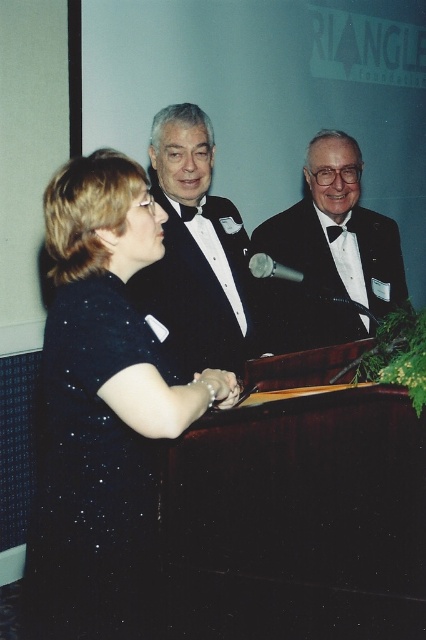
Question: Considering the relative positions of black satin tuxedo at center and black satin suit at center in the image provided, where is black satin tuxedo at center located with respect to black satin suit at center?

Choices:
 (A) below
 (B) above

Answer: (A)

Question: Which of the following is the farthest from the observer?

Choices:
 (A) (60, 444)
 (B) (167, 141)
 (C) (362, 300)
 (D) (181, 204)

Answer: (C)

Question: Which point is farther to the camera?

Choices:
 (A) (152, 582)
 (B) (345, 196)

Answer: (B)

Question: Which of the following is the closest to the observer?

Choices:
 (A) (313, 188)
 (B) (189, 205)

Answer: (B)

Question: Does black satin tuxedo at center have a greater width compared to black satin suit at center?

Choices:
 (A) no
 (B) yes

Answer: (A)

Question: Is black sequined dress at left closer to the viewer compared to black satin tuxedo at center?

Choices:
 (A) no
 (B) yes

Answer: (B)